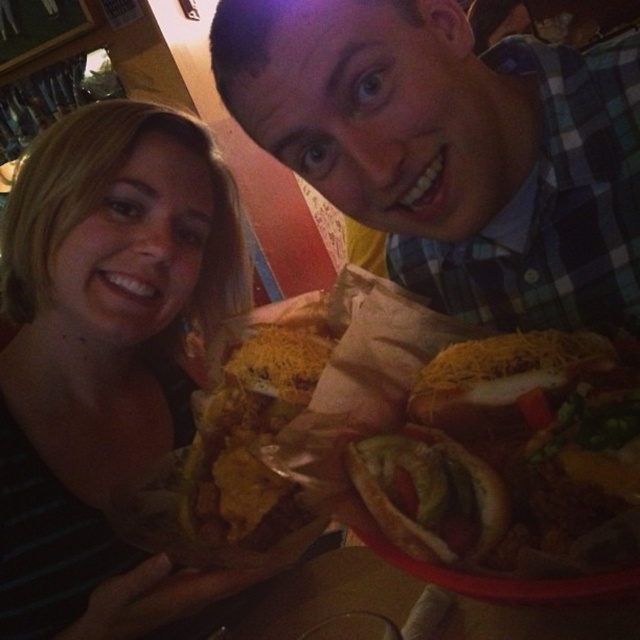
In the scene shown: Which is more to the left, matte black shirt at lower left or golden shredded cheese hot dog at center?

matte black shirt at lower left

Is point (76, 540) in front of point (458, 426)?

No, it is not.

I want to click on matte black shirt at lower left, so click(100, 336).

Consider the image. Which is more to the right, green plaid shirt at upper right or matte black shirt at lower left?

green plaid shirt at upper right

Can you confirm if green plaid shirt at upper right is taller than matte black shirt at lower left?

In fact, green plaid shirt at upper right may be shorter than matte black shirt at lower left.

Identify the location of green plaid shirt at upper right. This screenshot has height=640, width=640. (452, 148).

Does point (428, 36) come farther from viewer compared to point (436, 540)?

Yes.

Does point (595, 317) come in front of point (435, 481)?

No, it is behind (435, 481).

Locate an element on the screen. The width and height of the screenshot is (640, 640). green plaid shirt at upper right is located at coordinates (452, 148).